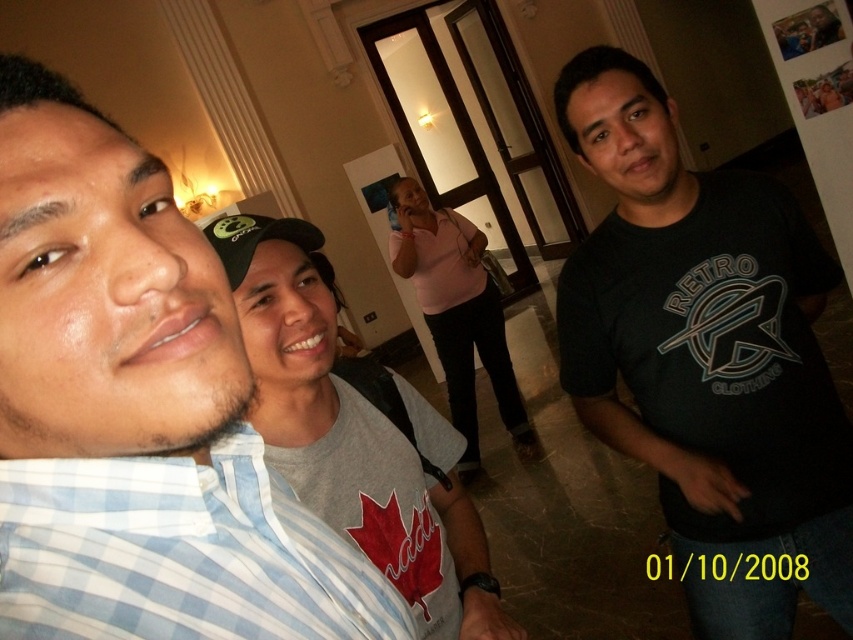
Question: Is blue plaid shirt at left wider than black matte shirt at center?

Choices:
 (A) no
 (B) yes

Answer: (A)

Question: Can you confirm if gray cotton t-shirt at center is bigger than pink fabric shirt at center?

Choices:
 (A) yes
 (B) no

Answer: (B)

Question: Which object is the closest to the gray cotton t-shirt at center?

Choices:
 (A) blue and white checkered shirt at left
 (B) pink fabric shirt at center

Answer: (A)

Question: Considering the real-world distances, which object is closest to the blue plaid shirt at left?

Choices:
 (A) gray cotton t-shirt at center
 (B) pink fabric shirt at center

Answer: (A)

Question: Which object is closer to the camera taking this photo?

Choices:
 (A) black matte shirt at center
 (B) gray cotton t-shirt at center

Answer: (B)

Question: Does blue plaid shirt at left have a smaller size compared to gray cotton t-shirt at center?

Choices:
 (A) yes
 (B) no

Answer: (A)